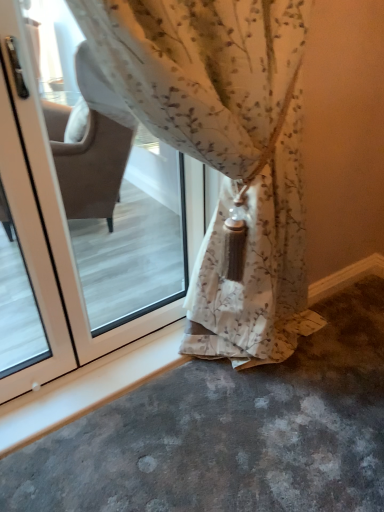
Question: Can you confirm if floral fabric curtain at center is thinner than white glossy screen door at left?

Choices:
 (A) no
 (B) yes

Answer: (A)

Question: Can you confirm if floral fabric curtain at center is positioned to the right of white glossy screen door at left?

Choices:
 (A) yes
 (B) no

Answer: (A)

Question: Would you consider floral fabric curtain at center to be distant from white glossy screen door at left?

Choices:
 (A) no
 (B) yes

Answer: (A)

Question: Considering the relative sizes of floral fabric curtain at center and white glossy screen door at left in the image provided, is floral fabric curtain at center smaller than white glossy screen door at left?

Choices:
 (A) yes
 (B) no

Answer: (B)

Question: Is floral fabric curtain at center oriented towards white glossy screen door at left?

Choices:
 (A) yes
 (B) no

Answer: (B)

Question: Is floral fabric curtain at center outside of white glossy screen door at left?

Choices:
 (A) no
 (B) yes

Answer: (B)

Question: Considering the relative positions of white glossy screen door at left and floral fabric curtain at center in the image provided, is white glossy screen door at left behind floral fabric curtain at center?

Choices:
 (A) no
 (B) yes

Answer: (B)

Question: Can you confirm if white glossy screen door at left is positioned to the left of floral fabric curtain at center?

Choices:
 (A) no
 (B) yes

Answer: (B)

Question: From a real-world perspective, does white glossy screen door at left sit lower than floral fabric curtain at center?

Choices:
 (A) yes
 (B) no

Answer: (A)

Question: Can you confirm if white glossy screen door at left is bigger than floral fabric curtain at center?

Choices:
 (A) yes
 (B) no

Answer: (B)

Question: Is white glossy screen door at left at the right side of floral fabric curtain at center?

Choices:
 (A) yes
 (B) no

Answer: (B)

Question: Would you say white glossy screen door at left contains floral fabric curtain at center?

Choices:
 (A) no
 (B) yes

Answer: (A)

Question: From the image's perspective, is floral fabric curtain at center positioned above or below white glossy screen door at left?

Choices:
 (A) above
 (B) below

Answer: (A)